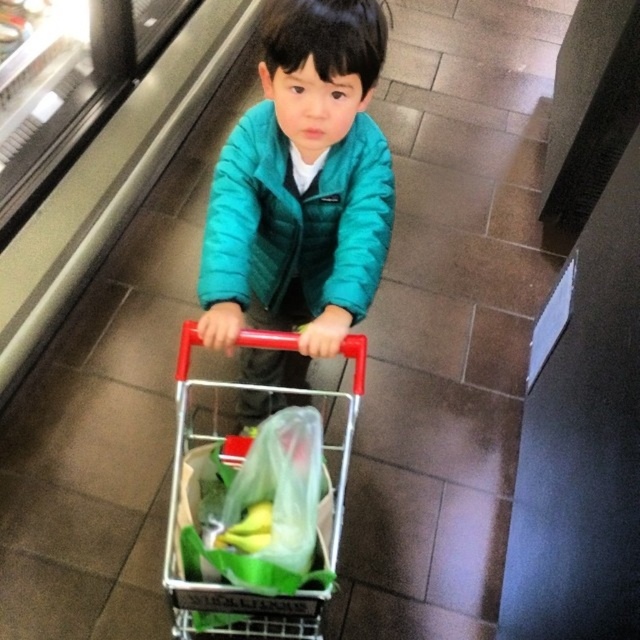
The point at coordinates (296, 220) is located on which object in the scene?

The point at coordinates (296, 220) is on the teal quilted jacket at center.

The teal quilted jacket at center is located at what coordinates?

The teal quilted jacket at center is located at coordinates point (296, 220).

You are a customer in the store and want to pick up the translucent plastic bag at center. The metallic red trolley at center is blocking your path. Can you reach the bag without moving the trolley?

The translucent plastic bag at center is behind the metallic red trolley at center, so you can reach it without moving the trolley since it is positioned behind the obstruction.